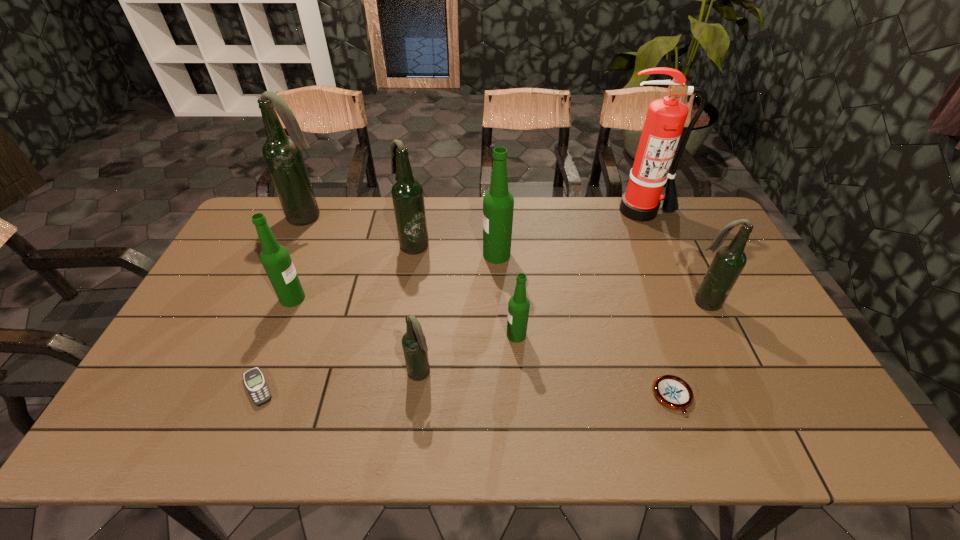
The image size is (960, 540). Identify the location of vacant space located on the label of the farthest green beer bottle. (440, 255).

At what (x,y) coordinates should I click in order to perform the action: click on vacant space located on the left of the third smallest dark beer bottle. Please return your answer as a coordinate pair (x, y). The image size is (960, 540). Looking at the image, I should click on (360, 244).

Identify the location of blank space located 0.320m on the label of the leftmost green beer bottle. (414, 298).

This screenshot has width=960, height=540. Identify the location of free spot located on the front of the rightmost dark beer bottle. (754, 409).

At what (x,y) coordinates should I click in order to perform the action: click on free region located on the label of the smallest green beer bottle. Please return your answer as a coordinate pair (x, y). Looking at the image, I should click on (484, 335).

What are the coordinates of `free location located 0.390m on the label of the smallest green beer bottle` in the screenshot? It's located at (363, 335).

The height and width of the screenshot is (540, 960). Find the location of `free space located 0.200m on the label of the smallest green beer bottle`. free space located 0.200m on the label of the smallest green beer bottle is located at coordinates (433, 335).

Locate an element on the screen. free space located on the right of the smallest dark beer bottle is located at coordinates (477, 374).

Where is `vacant area located 0.120m on the left of the compass`? vacant area located 0.120m on the left of the compass is located at coordinates (604, 397).

At what (x,y) coordinates should I click in order to perform the action: click on vacant area situated 0.200m on the left of the shortest object. Please return your answer as a coordinate pair (x, y). Looking at the image, I should click on (158, 388).